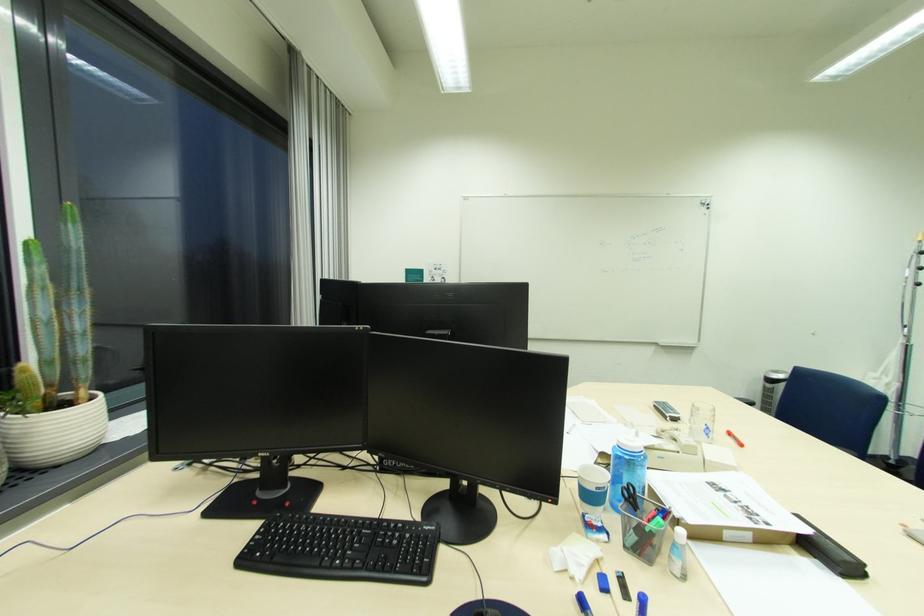
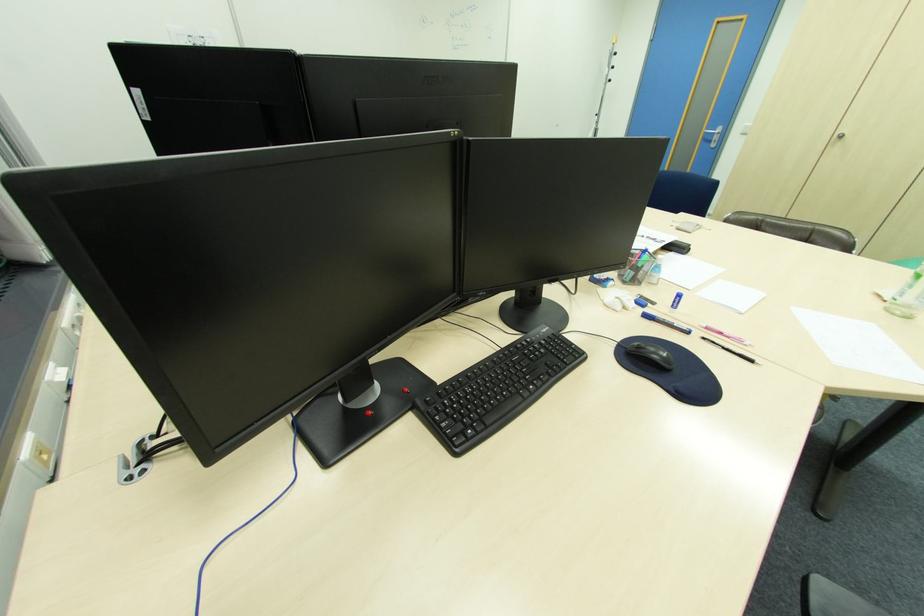
The point at (406, 525) is marked in the first image. Where is the corresponding point in the second image?

(533, 339)